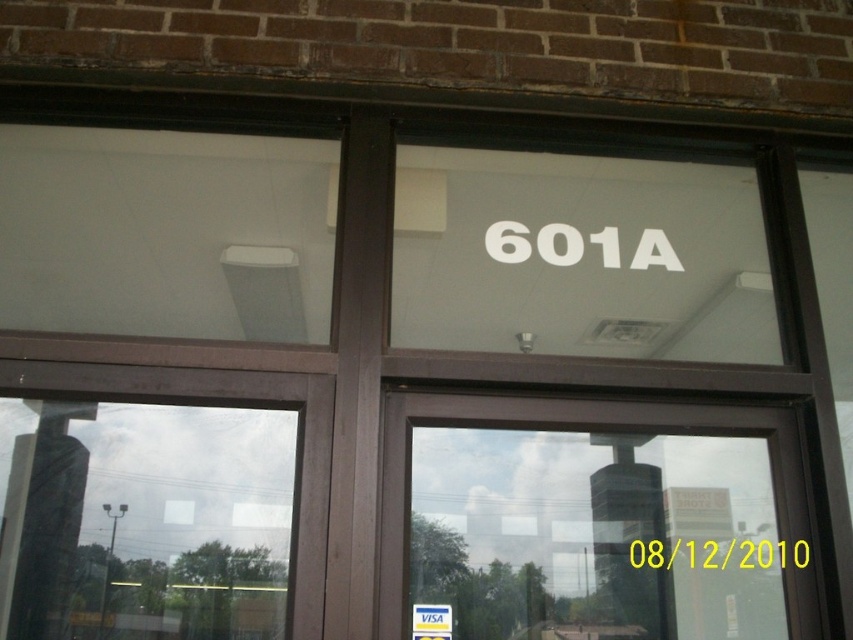
Is transparent glass door at center bigger than white plastic visa card at center?

Correct, transparent glass door at center is larger in size than white plastic visa card at center.

Between transparent glass door at center and white plastic visa card at center, which one appears on the left side from the viewer's perspective?

From the viewer's perspective, white plastic visa card at center appears more on the left side.

You are a GUI agent. You are given a task and a screenshot of the screen. Output one action in this format:
    pyautogui.click(x=<x>, y=<y>)
    Task: Click on the transparent glass door at center
    Image resolution: width=853 pixels, height=640 pixels.
    Given the screenshot: What is the action you would take?
    pyautogui.click(x=593, y=518)